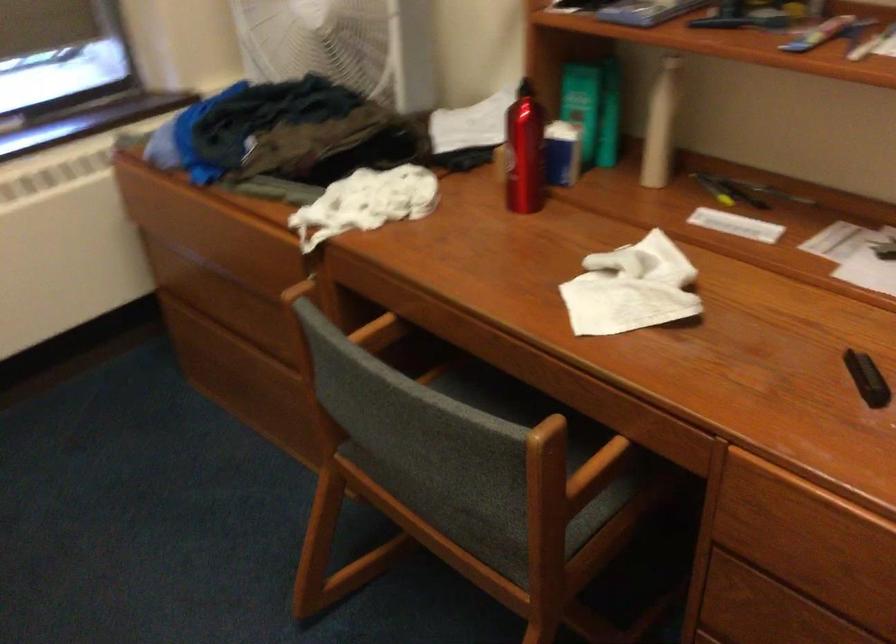
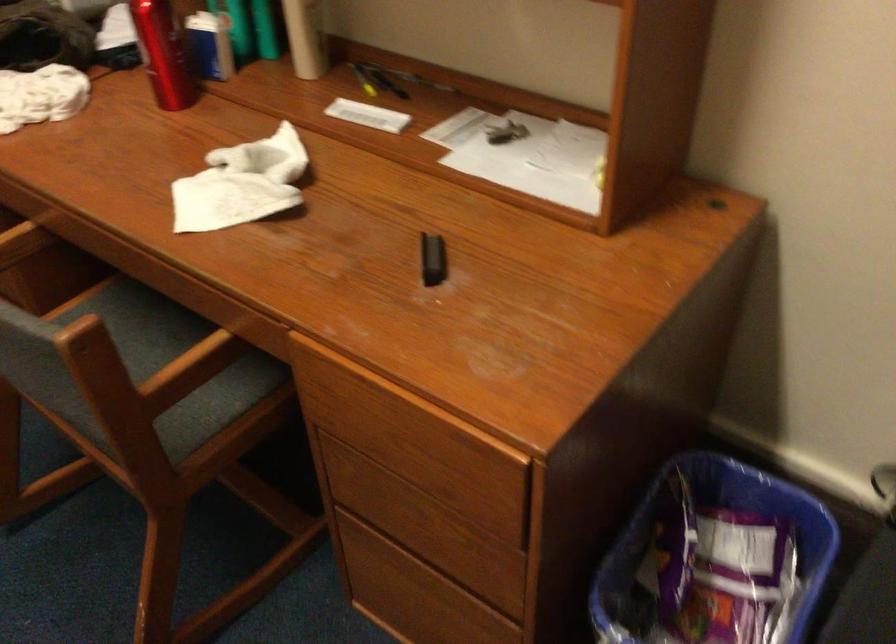
Locate, in the second image, the point that corresponds to (x=728, y=185) in the first image.

(376, 80)